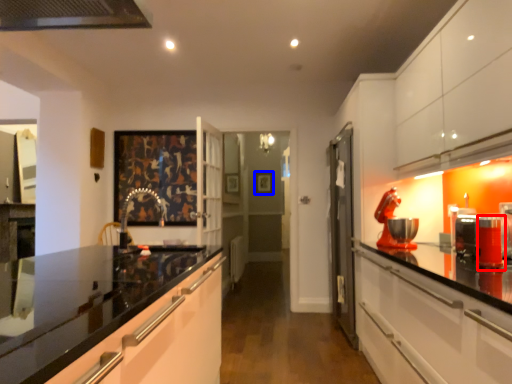
Question: Which of the following is the farthest to the observer, appliance (highlighted by a red box) or picture frame (highlighted by a blue box)?

Choices:
 (A) appliance
 (B) picture frame

Answer: (B)